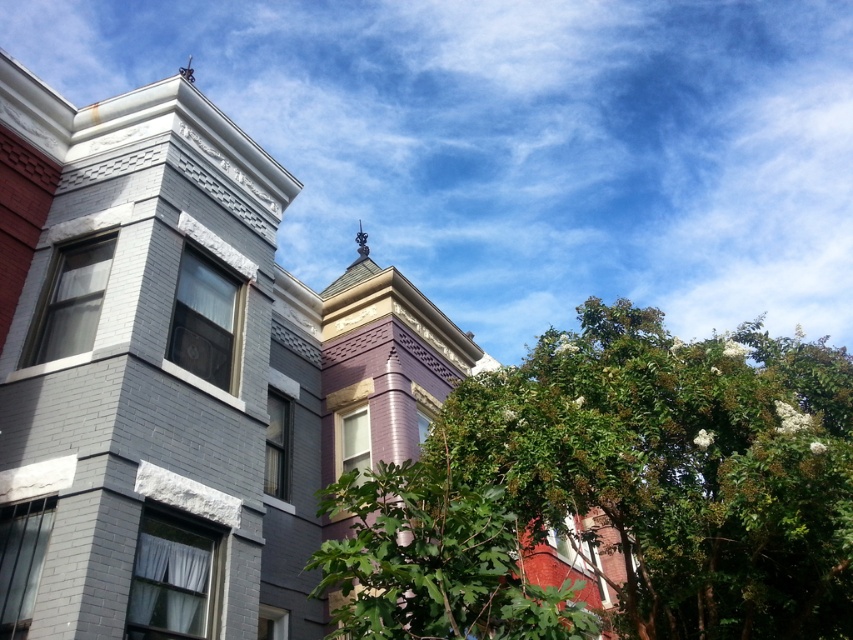
Which is below, green leafy tree at center or green leafy tree at lower right?

Positioned lower is green leafy tree at center.

Describe the element at coordinates (679, 467) in the screenshot. The image size is (853, 640). I see `green leafy tree at center` at that location.

Find the location of a particular element. The height and width of the screenshot is (640, 853). green leafy tree at center is located at coordinates (679, 467).